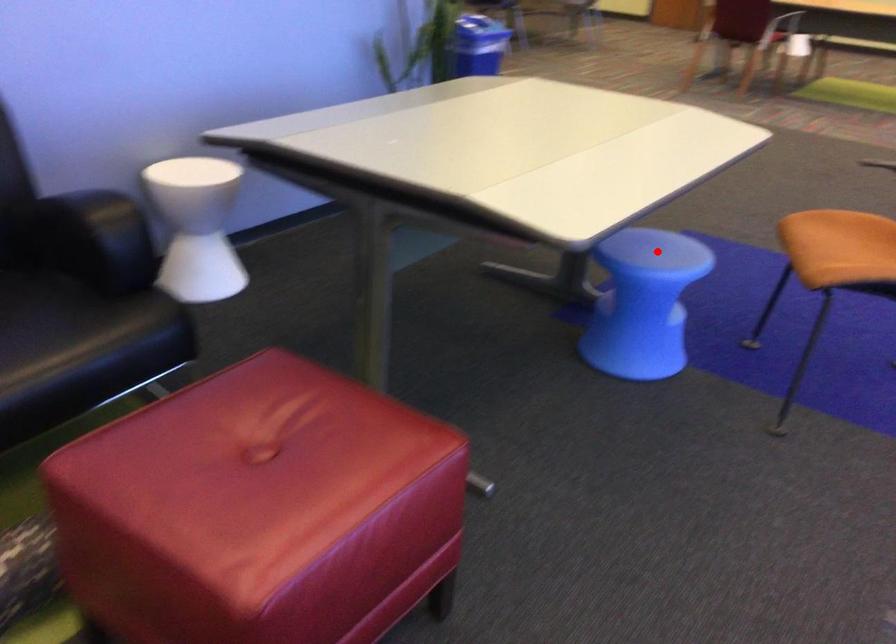
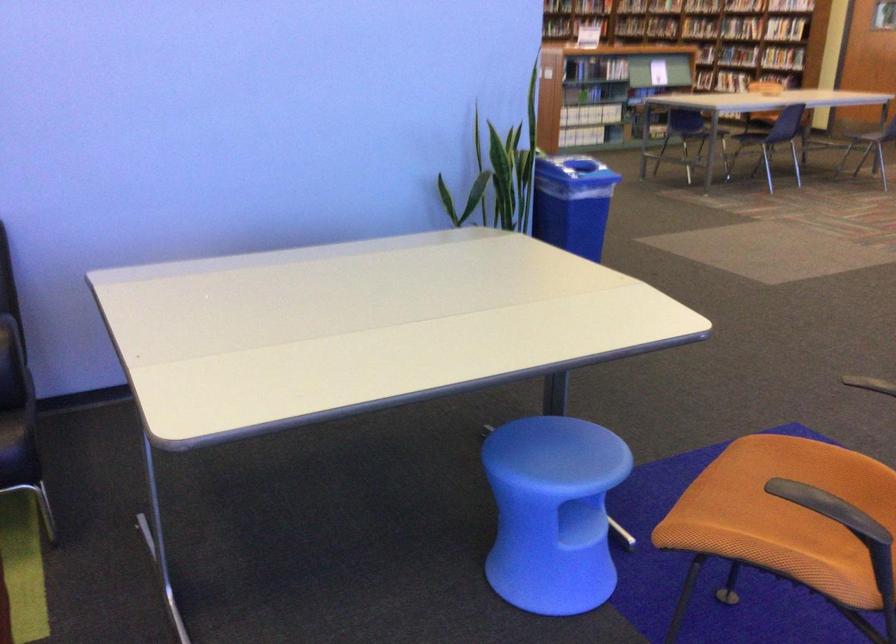
Question: A red point is marked in image1. In image2, is the corresponding 3D point closer to the camera or farther? Reply with the corresponding letter.

Choices:
 (A) The corresponding 3D point is closer.
 (B) The corresponding 3D point is farther.

Answer: (A)